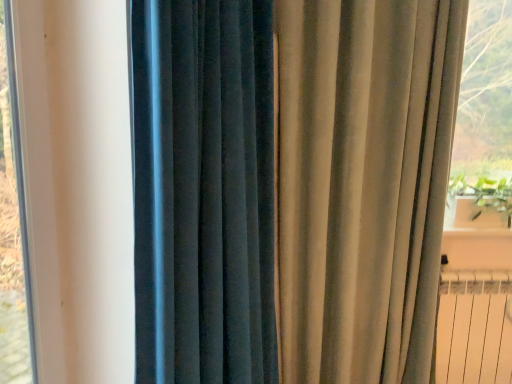
What do you see at coordinates (362, 183) in the screenshot? I see `satin beige curtain at right, which is the 2th curtain in left-to-right order` at bounding box center [362, 183].

This screenshot has height=384, width=512. Identify the location of white metallic radiator at lower right. (474, 328).

Identify the location of green leafy plant at right. (485, 196).

Which of these two, satin beige curtain at right, which is the 2th curtain in left-to-right order, or white metallic radiator at lower right, stands taller?

satin beige curtain at right, which is the 2th curtain in left-to-right order.

Considering the positions of points (177, 127) and (492, 282), is point (177, 127) farther from camera compared to point (492, 282)?

That is False.

Is satin beige curtain at right, which is the 2th curtain in left-to-right order, oriented away from white metallic radiator at lower right?

satin beige curtain at right, which is the 2th curtain in left-to-right order, is not turned away from white metallic radiator at lower right.

Is satin beige curtain at right, which is the 2th curtain in left-to-right order, far from white metallic radiator at lower right?

No, there isn't a large distance between satin beige curtain at right, which is the 2th curtain in left-to-right order, and white metallic radiator at lower right.

Which object is further away from the camera, white plastic window frame at left or white metallic radiator at lower right?

white metallic radiator at lower right is further from the camera.

In the scene shown: Is white plastic window frame at left aimed at white metallic radiator at lower right?

No, white plastic window frame at left is not aimed at white metallic radiator at lower right.

Considering the sizes of objects white plastic window frame at left and white metallic radiator at lower right in the image provided, who is wider, white plastic window frame at left or white metallic radiator at lower right?

With larger width is white metallic radiator at lower right.

Find the location of a particular element. radiator lying on the right of white plastic window frame at left is located at coordinates (474, 328).

Between green leafy plant at right and velvet dark blue curtain at left, which appears as the 1th curtain when viewed from the left, which one is positioned in front?

velvet dark blue curtain at left, which appears as the 1th curtain when viewed from the left, is closer to the camera.

Considering the positions of objects green leafy plant at right and velvet dark blue curtain at left, which appears as the 1th curtain when viewed from the left, in the image provided, who is more to the right, green leafy plant at right or velvet dark blue curtain at left, which appears as the 1th curtain when viewed from the left,?

green leafy plant at right is more to the right.

From the image's perspective, is green leafy plant at right beneath velvet dark blue curtain at left, which appears as the 1th curtain when viewed from the left?

Incorrect, from the image's perspective, green leafy plant at right is higher than velvet dark blue curtain at left, which appears as the 1th curtain when viewed from the left.

How many degrees apart are the facing directions of satin beige curtain at right, which is the 2th curtain in left-to-right order, and velvet dark blue curtain at left, which appears as the 1th curtain when viewed from the left?

57 degrees separate the facing orientations of satin beige curtain at right, which is the 2th curtain in left-to-right order, and velvet dark blue curtain at left, which appears as the 1th curtain when viewed from the left.

Is satin beige curtain at right, the 1th curtain viewed from the right, not close to velvet dark blue curtain at left, the second curtain from the right?

No, satin beige curtain at right, the 1th curtain viewed from the right, is not far away from velvet dark blue curtain at left, the second curtain from the right.

In the scene shown: From the image's perspective, is satin beige curtain at right, which is the 2th curtain in left-to-right order, beneath velvet dark blue curtain at left, the second curtain from the right?

No.

Considering the relative positions of satin beige curtain at right, the 1th curtain viewed from the right, and velvet dark blue curtain at left, the second curtain from the right, in the image provided, is satin beige curtain at right, the 1th curtain viewed from the right, to the right of velvet dark blue curtain at left, the second curtain from the right, from the viewer's perspective?

Correct, you'll find satin beige curtain at right, the 1th curtain viewed from the right, to the right of velvet dark blue curtain at left, the second curtain from the right.

Is velvet dark blue curtain at left, which appears as the 1th curtain when viewed from the left, to the right of green leafy plant at right from the viewer's perspective?

Incorrect, velvet dark blue curtain at left, which appears as the 1th curtain when viewed from the left, is not on the right side of green leafy plant at right.

Is velvet dark blue curtain at left, the second curtain from the right, turned away from green leafy plant at right?

No, velvet dark blue curtain at left, the second curtain from the right, is not facing the opposite direction of green leafy plant at right.

Is point (232, 203) more distant than point (507, 210)?

No, it is not.

At what (x,y) coordinates should I click in order to perform the action: click on plant lying behind the velvet dark blue curtain at left, the second curtain from the right. Please return your answer as a coordinate pair (x, y). This screenshot has height=384, width=512. Looking at the image, I should click on (x=485, y=196).

Between velvet dark blue curtain at left, which appears as the 1th curtain when viewed from the left, and white metallic radiator at lower right, which one has larger width?

Wider between the two is velvet dark blue curtain at left, which appears as the 1th curtain when viewed from the left.

Choose the correct answer: Is velvet dark blue curtain at left, which appears as the 1th curtain when viewed from the left, inside white metallic radiator at lower right or outside it?

velvet dark blue curtain at left, which appears as the 1th curtain when viewed from the left, exists outside the volume of white metallic radiator at lower right.

Is velvet dark blue curtain at left, which appears as the 1th curtain when viewed from the left, positioned behind white metallic radiator at lower right?

No, it is in front of white metallic radiator at lower right.

Can you tell me how much velvet dark blue curtain at left, the second curtain from the right, and white metallic radiator at lower right differ in facing direction?

There is a 59.8-degree angle between the facing directions of velvet dark blue curtain at left, the second curtain from the right, and white metallic radiator at lower right.

Is white metallic radiator at lower right inside the boundaries of green leafy plant at right, or outside?

white metallic radiator at lower right is located beyond the bounds of green leafy plant at right.

Measure the distance between white metallic radiator at lower right and green leafy plant at right.

The distance of white metallic radiator at lower right from green leafy plant at right is 18.40 inches.

Does point (506, 378) appear closer or farther from the camera than point (456, 188)?

Point (506, 378) is closer to the camera than point (456, 188).

Locate an element on the screen. The width and height of the screenshot is (512, 384). radiator on the right of satin beige curtain at right, the 1th curtain viewed from the right is located at coordinates (474, 328).

This screenshot has height=384, width=512. Identify the location of radiator below the white plastic window frame at left (from a real-world perspective). (474, 328).

Looking at the image, which one is located further to satin beige curtain at right, which is the 2th curtain in left-to-right order, white plastic window frame at left or white metallic radiator at lower right?

white metallic radiator at lower right lies further to satin beige curtain at right, which is the 2th curtain in left-to-right order, than the other object.

When comparing their distances from green leafy plant at right, does white metallic radiator at lower right or velvet dark blue curtain at left, which appears as the 1th curtain when viewed from the left, seem closer?

Based on the image, white metallic radiator at lower right appears to be nearer to green leafy plant at right.

Estimate the real-world distances between objects in this image. Which object is closer to satin beige curtain at right, the 1th curtain viewed from the right, velvet dark blue curtain at left, which appears as the 1th curtain when viewed from the left, or white metallic radiator at lower right?

velvet dark blue curtain at left, which appears as the 1th curtain when viewed from the left, lies closer to satin beige curtain at right, the 1th curtain viewed from the right, than the other object.

When comparing their distances from white metallic radiator at lower right, does satin beige curtain at right, which is the 2th curtain in left-to-right order, or white plastic window frame at left seem closer?

Based on the image, satin beige curtain at right, which is the 2th curtain in left-to-right order, appears to be nearer to white metallic radiator at lower right.

Estimate the real-world distances between objects in this image. Which object is closer to velvet dark blue curtain at left, the second curtain from the right, white plastic window frame at left or green leafy plant at right?

The object closer to velvet dark blue curtain at left, the second curtain from the right, is white plastic window frame at left.

Looking at this image, which object lies nearer to the anchor point satin beige curtain at right, the 1th curtain viewed from the right, white metallic radiator at lower right or white plastic window frame at left?

Among the two, white plastic window frame at left is located nearer to satin beige curtain at right, the 1th curtain viewed from the right.

Estimate the real-world distances between objects in this image. Which object is further from white metallic radiator at lower right, white plastic window frame at left or green leafy plant at right?

white plastic window frame at left.

Looking at the image, which one is located closer to white metallic radiator at lower right, velvet dark blue curtain at left, the second curtain from the right, or satin beige curtain at right, the 1th curtain viewed from the right?

satin beige curtain at right, the 1th curtain viewed from the right, lies closer to white metallic radiator at lower right than the other object.

Locate an element on the screen. Image resolution: width=512 pixels, height=384 pixels. curtain between velvet dark blue curtain at left, the second curtain from the right, and white metallic radiator at lower right from left to right is located at coordinates (362, 183).

Find the location of a particular element. The height and width of the screenshot is (384, 512). radiator between satin beige curtain at right, which is the 2th curtain in left-to-right order, and green leafy plant at right is located at coordinates (474, 328).

Image resolution: width=512 pixels, height=384 pixels. In order to click on radiator between white plastic window frame at left and green leafy plant at right in the horizontal direction in this screenshot , I will do `click(474, 328)`.

Where is `curtain between white plastic window frame at left and satin beige curtain at right, the 1th curtain viewed from the right, from left to right`? Image resolution: width=512 pixels, height=384 pixels. curtain between white plastic window frame at left and satin beige curtain at right, the 1th curtain viewed from the right, from left to right is located at coordinates (204, 191).